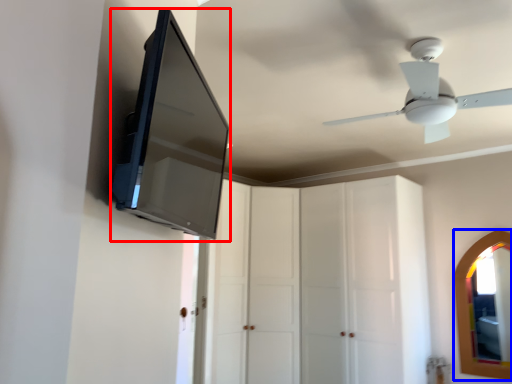
Question: Which of the following is the farthest to the observer, medicine cabinet (highlighted by a red box) or mirror (highlighted by a blue box)?

Choices:
 (A) medicine cabinet
 (B) mirror

Answer: (B)